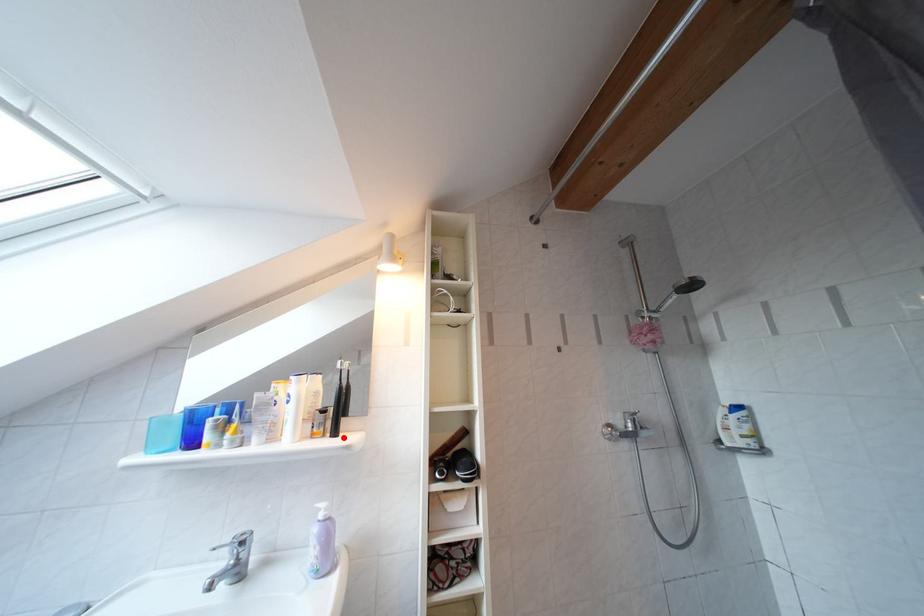
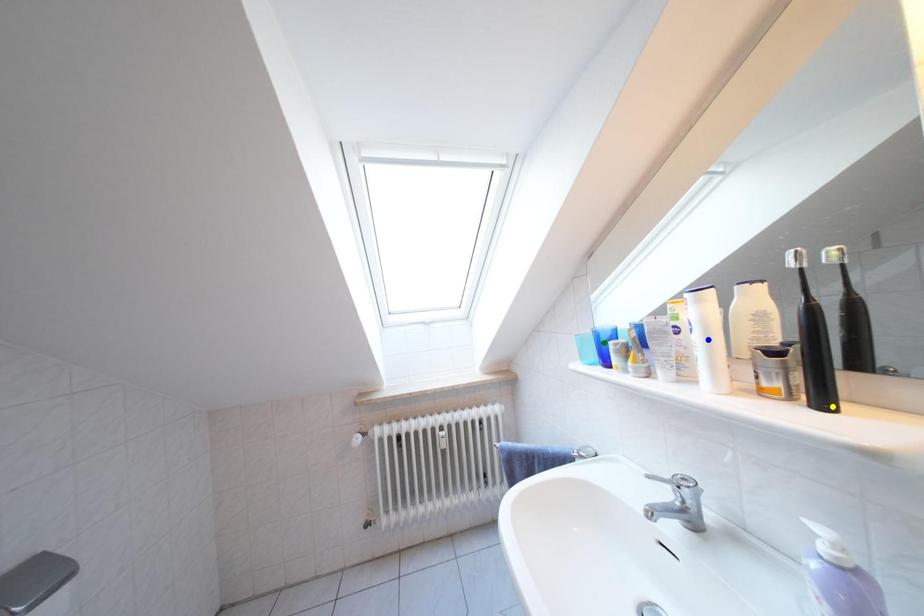
Question: I am providing you with two images of the same scene from different viewpoints. A red point is marked on the first image. You are given multiple points on the second image. Which mark in image 2 goes with the point in image 1?

Choices:
 (A) blue point
 (B) green point
 (C) yellow point

Answer: (C)